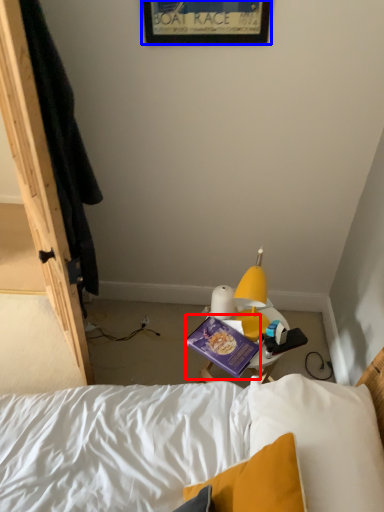
Question: Among these objects, which one is nearest to the camera, paperback book (highlighted by a red box) or picture frame (highlighted by a blue box)?

Choices:
 (A) paperback book
 (B) picture frame

Answer: (B)